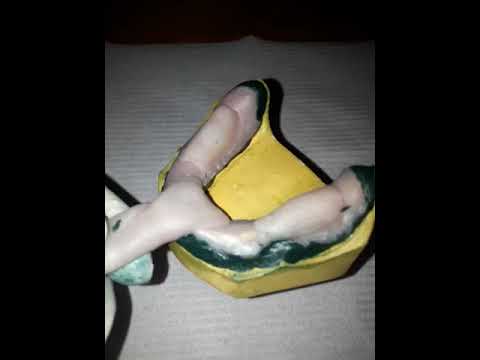
This screenshot has height=360, width=480. Find the location of `shadow to right of dustpan`. shadow to right of dustpan is located at coordinates point(364,265), point(280,135).